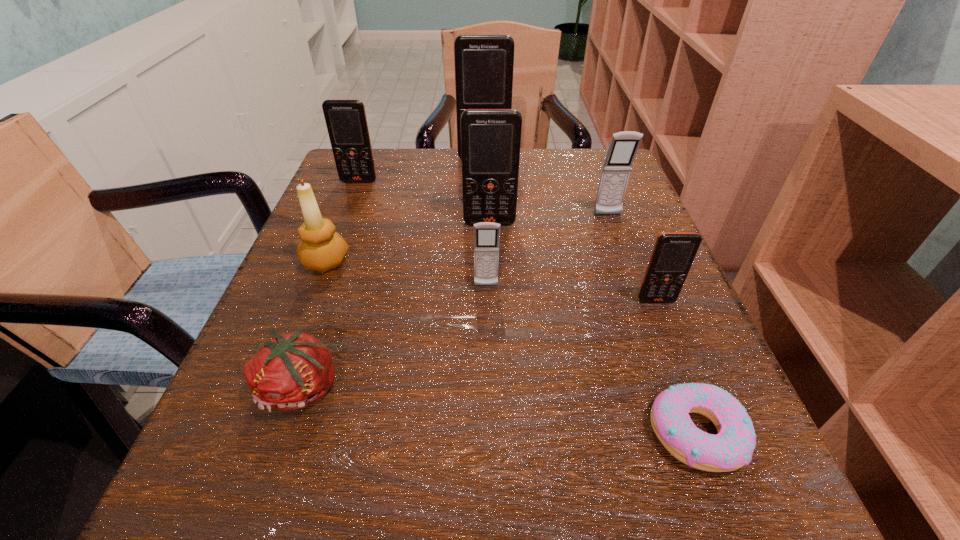
I want to click on object that is at the far left corner, so click(346, 121).

Identify the location of object that is at the near right corner. The height and width of the screenshot is (540, 960). (732, 448).

Where is `vacant space at the far edge of the desktop`? The image size is (960, 540). vacant space at the far edge of the desktop is located at coordinates (413, 185).

Identify the location of free location at the near edge. (484, 472).

The width and height of the screenshot is (960, 540). I want to click on vacant area at the left edge of the desktop, so click(x=353, y=208).

The width and height of the screenshot is (960, 540). Identify the location of free space at the right edge. (660, 379).

The height and width of the screenshot is (540, 960). Find the location of `free location at the far left corner`. free location at the far left corner is located at coordinates (381, 202).

In the image, there is a desktop. Identify the location of vacant space at the near left corner. (266, 532).

This screenshot has width=960, height=540. In the image, there is a desktop. Identify the location of vacant space at the far right corner. (557, 159).

This screenshot has height=540, width=960. In the image, there is a desktop. Find the location of `free space at the near right corner`. free space at the near right corner is located at coordinates (764, 503).